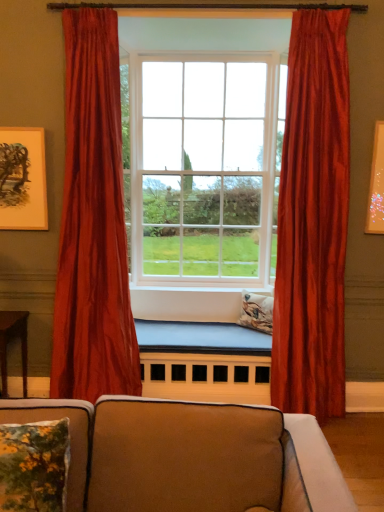
Question: Considering their positions, is wooden table at lower left located in front of or behind floral fabric pillow at lower left, marked as the 1th pillow in a bottom-to-top arrangement?

Choices:
 (A) behind
 (B) front

Answer: (A)

Question: Is point (6, 333) positioned closer to the camera than point (29, 450)?

Choices:
 (A) closer
 (B) farther

Answer: (B)

Question: Estimate the real-world distances between objects in this image. Which object is closer to the floral fabric pillow at lower left, marked as the 1th pillow in a bottom-to-top arrangement?

Choices:
 (A) suede-like beige couch at lower center
 (B) satin red curtain at right, marked as the second curtain in a left-to-right arrangement
 (C) satin red curtain at left, positioned as the first curtain in left-to-right order
 (D) matte gold picture frame at upper left
 (E) wooden table at lower left

Answer: (A)

Question: Considering the real-world distances, which object is closest to the floral fabric pillow at center, which is the 2th pillow in bottom-to-top order?

Choices:
 (A) wooden table at lower left
 (B) satin red curtain at right, marked as the second curtain in a left-to-right arrangement
 (C) matte gold picture frame at upper left
 (D) suede-like beige couch at lower center
 (E) matte glass window at center

Answer: (B)